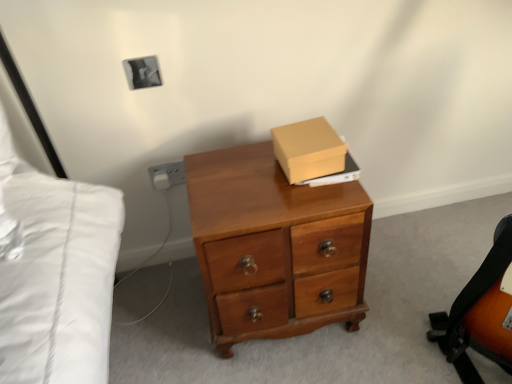
Question: Is point (207, 258) closer or farther from the camera than point (497, 332)?

Choices:
 (A) farther
 (B) closer

Answer: (B)

Question: In terms of width, does wooden desk at center look wider or thinner when compared to orange leather messenger bag at lower right?

Choices:
 (A) thin
 (B) wide

Answer: (B)

Question: Based on their relative distances, which object is farther from the matte cardboard box at upper center?

Choices:
 (A) matte gray electric outlet at lower left
 (B) wooden desk at center
 (C) orange leather messenger bag at lower right

Answer: (C)

Question: Based on their relative distances, which object is nearer to the matte cardboard box at upper center?

Choices:
 (A) matte gray electric outlet at lower left
 (B) orange leather messenger bag at lower right
 (C) wooden desk at center

Answer: (C)